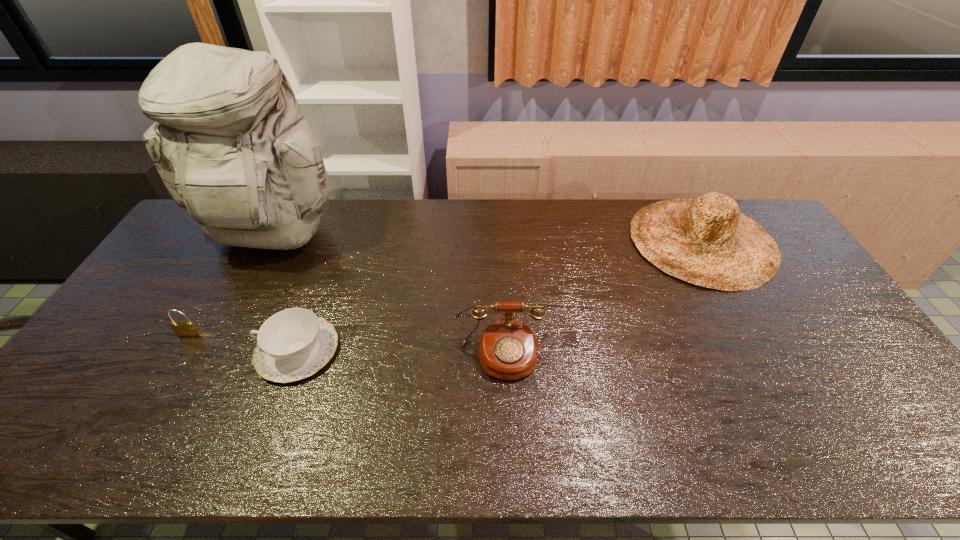
Find the location of a particular element. backpack is located at coordinates (230, 143).

Locate an element on the screen. The height and width of the screenshot is (540, 960). sunhat is located at coordinates (706, 241).

At what (x,y) coordinates should I click in order to perform the action: click on the fourth object from left to right. Please return your answer as a coordinate pair (x, y). Looking at the image, I should click on (508, 350).

Where is `the second shortest object`? the second shortest object is located at coordinates (184, 328).

At what (x,y) coordinates should I click in order to perform the action: click on the shortest object. Please return your answer as a coordinate pair (x, y). This screenshot has height=540, width=960. Looking at the image, I should click on (295, 343).

I want to click on vacant space located on the front-facing side of the tallest object, so click(225, 329).

Where is `vacant region located on the left of the rightmost object`? vacant region located on the left of the rightmost object is located at coordinates (529, 240).

Where is `free space located 0.140m on the dial of the second object from right to left`? The height and width of the screenshot is (540, 960). free space located 0.140m on the dial of the second object from right to left is located at coordinates (503, 434).

Image resolution: width=960 pixels, height=540 pixels. I want to click on free location located on the front-facing side of the padlock, so click(146, 410).

Image resolution: width=960 pixels, height=540 pixels. Identify the location of vacant space located on the handle side of the chinaware. (161, 350).